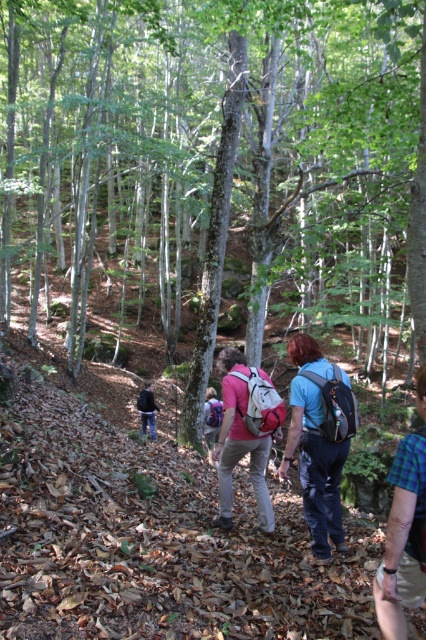
Question: In this image, where is matte pink backpack at center located relative to flannel shirt at lower right?

Choices:
 (A) above
 (B) below

Answer: (B)

Question: Which of the following is the closest to the observer?

Choices:
 (A) (354, 403)
 (B) (273, 42)
 (C) (420, 381)

Answer: (C)

Question: Is matte pink backpack at center to the left of flannel shirt at lower right from the viewer's perspective?

Choices:
 (A) yes
 (B) no

Answer: (A)

Question: Considering the real-world distances, which object is farthest from the flannel shirt at lower right?

Choices:
 (A) matte blue backpack at center
 (B) rough bark tree at center
 (C) matte pink backpack at center

Answer: (B)

Question: Which point appears closest to the camera in this image?

Choices:
 (A) (307, 474)
 (B) (425, 372)
 (C) (247, 388)

Answer: (B)

Question: Is rough bark tree at center thinner than matte pink backpack at center?

Choices:
 (A) yes
 (B) no

Answer: (B)